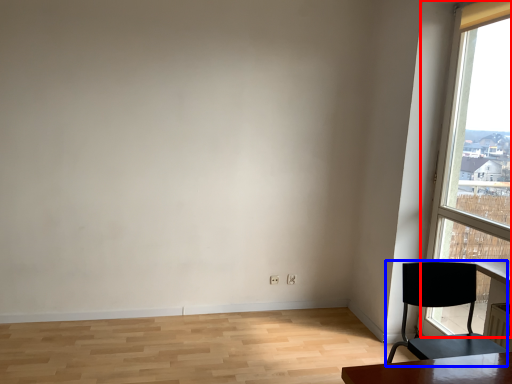
Question: Which of the following is the farthest to the observer, window (highlighted by a red box) or chair (highlighted by a blue box)?

Choices:
 (A) window
 (B) chair

Answer: (A)